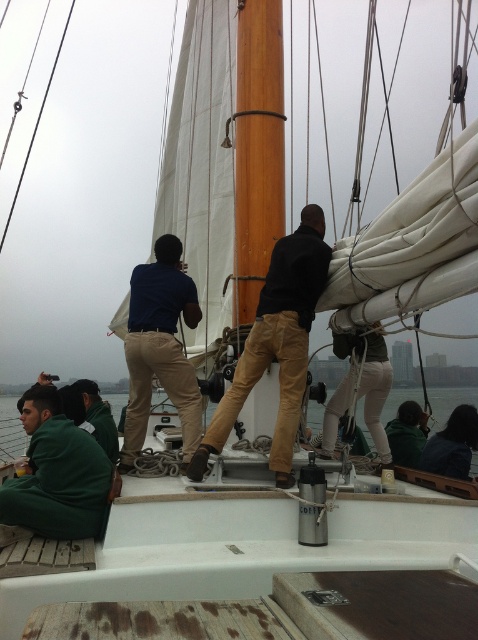
Is point (289, 440) positioned before point (262, 48)?

Yes.

Which is in front, point (272, 465) or point (264, 99)?

Point (272, 465) is in front.

Where is `dark brown leather pants at center`? This screenshot has height=640, width=478. dark brown leather pants at center is located at coordinates (276, 344).

You are a GUI agent. You are given a task and a screenshot of the screen. Output one action in this format:
    pyautogui.click(x=<x>, y=<y>)
    Task: Click on the dark brown leather pants at center
    
    Given the screenshot: What is the action you would take?
    pyautogui.click(x=276, y=344)

Is dark brown leather pants at center above green fleece jacket at lower left?

Correct, dark brown leather pants at center is located above green fleece jacket at lower left.

Is dark brown leather pants at center taller than green fleece jacket at lower left?

Indeed, dark brown leather pants at center has a greater height compared to green fleece jacket at lower left.

Image resolution: width=478 pixels, height=640 pixels. I want to click on dark brown leather pants at center, so click(276, 344).

Is point (21, 518) positioned in front of point (173, 310)?

Yes, point (21, 518) is closer to viewer.

Which of these two, green fleece jacket at lower left or matte blue shirt at center, stands taller?

matte blue shirt at center

Who is more forward, (x=78, y=458) or (x=121, y=465)?

Point (x=78, y=458)

The image size is (478, 640). Find the location of `green fleece jacket at lower left`. green fleece jacket at lower left is located at coordinates (58, 474).